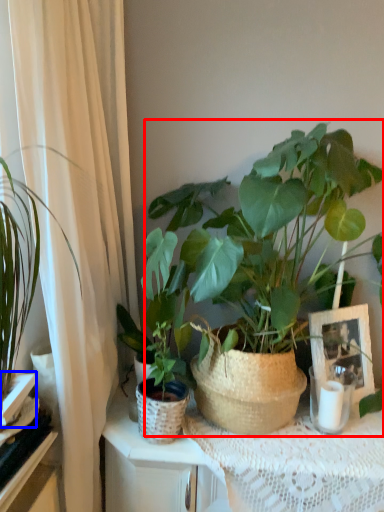
Question: Which object appears closest to the camera in this image, houseplant (highlighted by a red box) or shelf (highlighted by a blue box)?

Choices:
 (A) houseplant
 (B) shelf

Answer: (A)